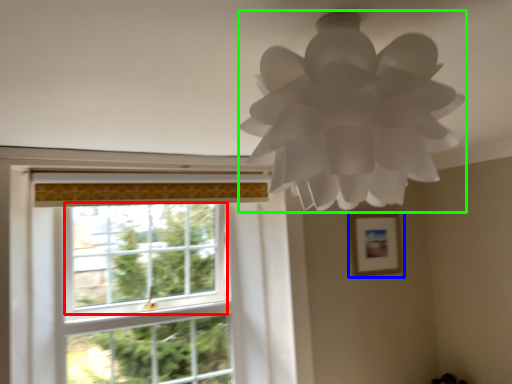
Question: Which object is the closest to the window screen (highlighted by a red box)? Choose among these: picture frame (highlighted by a blue box) or lamp (highlighted by a green box).

Choices:
 (A) picture frame
 (B) lamp

Answer: (A)